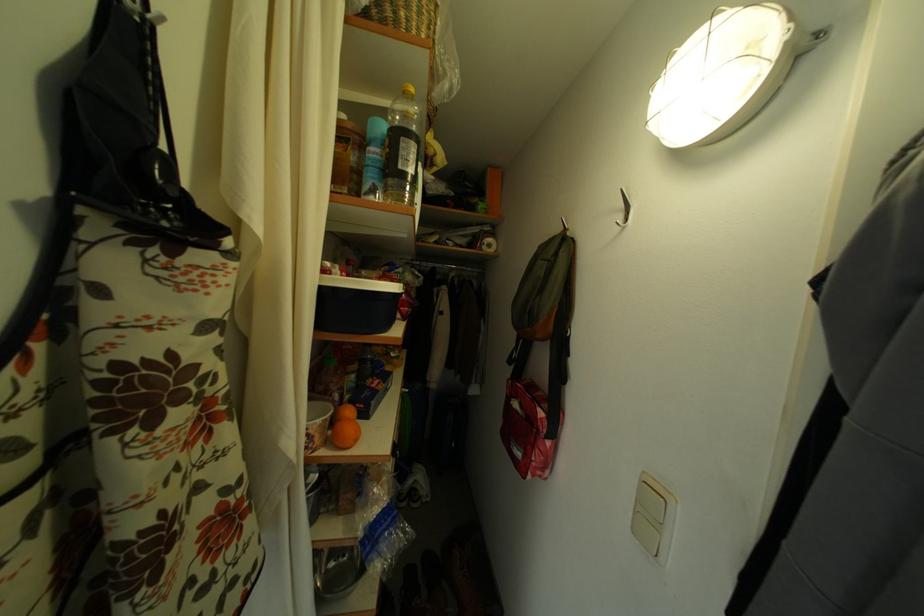
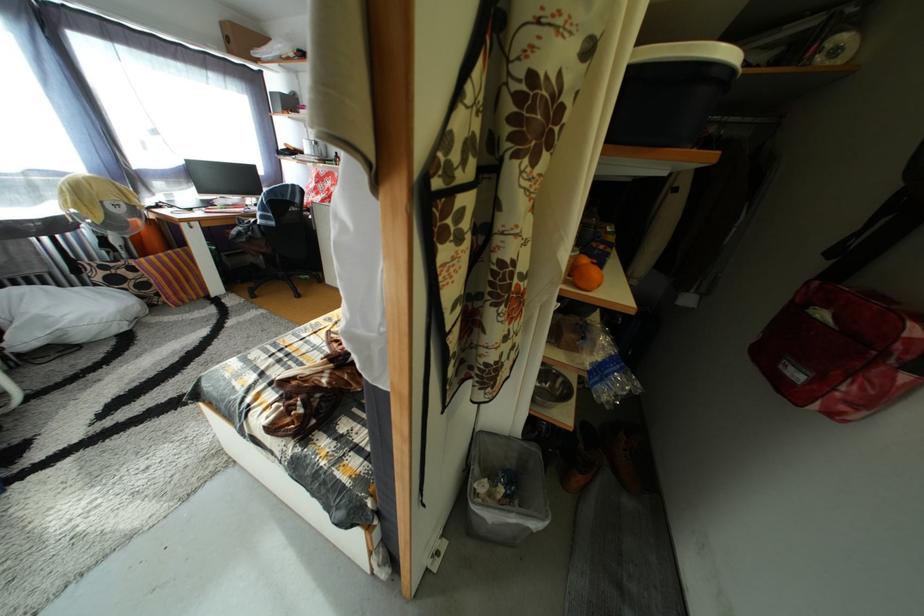
Based on the continuous images, in which direction is the camera rotating?

The camera's rotation is toward left-down.